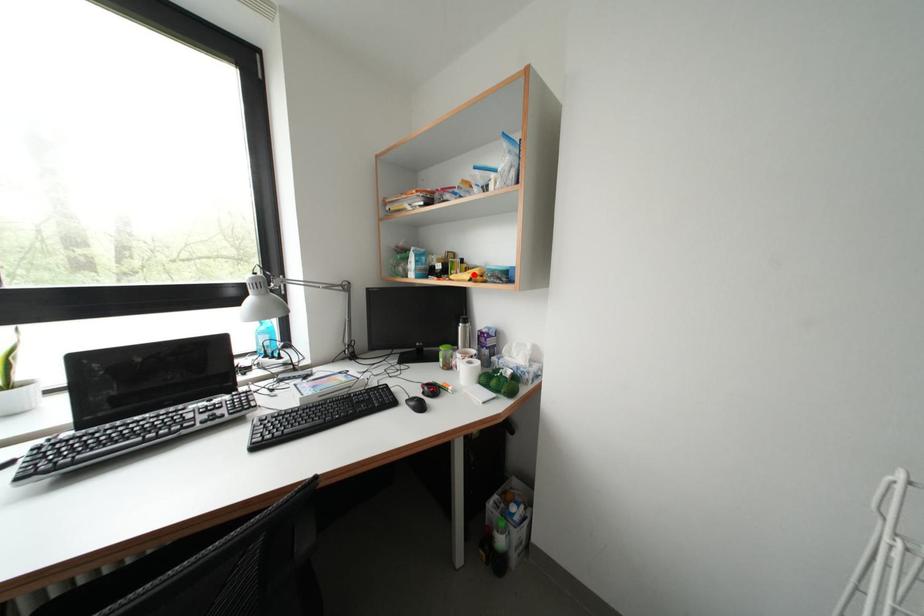
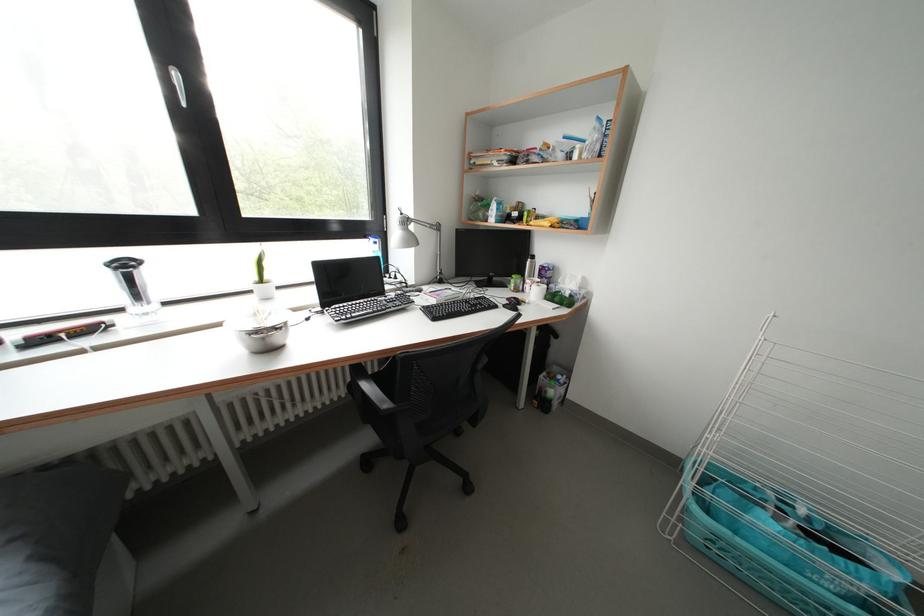
In the second image, find the point that corresponds to the highlighted location in the first image.

(544, 223)